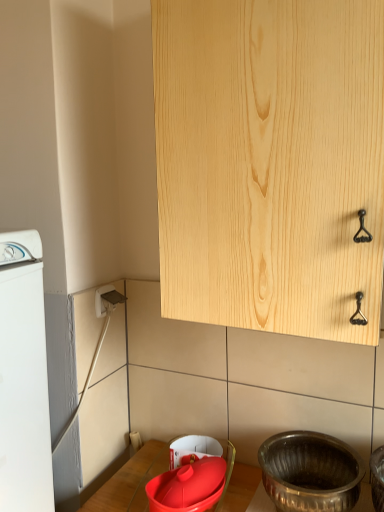
Question: Considering the relative positions of natural wood cabinet at upper center and matte red basin at lower center, positioned as the second basin in right-to-left order, in the image provided, is natural wood cabinet at upper center in front of matte red basin at lower center, positioned as the second basin in right-to-left order,?

Choices:
 (A) no
 (B) yes

Answer: (B)

Question: From the image's perspective, would you say natural wood cabinet at upper center is shown under matte red basin at lower center, positioned as the second basin in right-to-left order?

Choices:
 (A) no
 (B) yes

Answer: (A)

Question: Does natural wood cabinet at upper center have a lesser height compared to matte red basin at lower center, the first basin from the left?

Choices:
 (A) yes
 (B) no

Answer: (B)

Question: Does natural wood cabinet at upper center have a greater height compared to matte red basin at lower center, positioned as the second basin in right-to-left order?

Choices:
 (A) no
 (B) yes

Answer: (B)

Question: From a real-world perspective, is natural wood cabinet at upper center positioned over matte red basin at lower center, positioned as the second basin in right-to-left order, based on gravity?

Choices:
 (A) no
 (B) yes

Answer: (B)

Question: From a real-world perspective, is white plastic electric outlet at lower left above or below white plastic washing machine at left?

Choices:
 (A) above
 (B) below

Answer: (A)

Question: Considering the positions of white plastic electric outlet at lower left and white plastic washing machine at left in the image, is white plastic electric outlet at lower left wider or thinner than white plastic washing machine at left?

Choices:
 (A) wide
 (B) thin

Answer: (B)

Question: Is white plastic electric outlet at lower left situated inside white plastic washing machine at left or outside?

Choices:
 (A) outside
 (B) inside

Answer: (A)

Question: Looking at the image, does white plastic electric outlet at lower left seem bigger or smaller compared to white plastic washing machine at left?

Choices:
 (A) big
 (B) small

Answer: (B)

Question: Does point (228, 253) appear closer or farther from the camera than point (49, 451)?

Choices:
 (A) closer
 (B) farther

Answer: (A)

Question: From the image's perspective, is natural wood cabinet at upper center positioned above or below white plastic washing machine at left?

Choices:
 (A) above
 (B) below

Answer: (A)

Question: Is natural wood cabinet at upper center to the left or to the right of white plastic washing machine at left in the image?

Choices:
 (A) left
 (B) right

Answer: (B)

Question: In the image, is natural wood cabinet at upper center positioned in front of or behind white plastic washing machine at left?

Choices:
 (A) behind
 (B) front

Answer: (B)

Question: In terms of height, does polished silver basin at lower right, the 2th basin when ordered from left to right, look taller or shorter compared to natural wood cabinet at upper center?

Choices:
 (A) tall
 (B) short

Answer: (B)

Question: Considering the positions of polished silver basin at lower right, marked as the first basin in a right-to-left arrangement, and natural wood cabinet at upper center in the image, is polished silver basin at lower right, marked as the first basin in a right-to-left arrangement, wider or thinner than natural wood cabinet at upper center?

Choices:
 (A) wide
 (B) thin

Answer: (B)